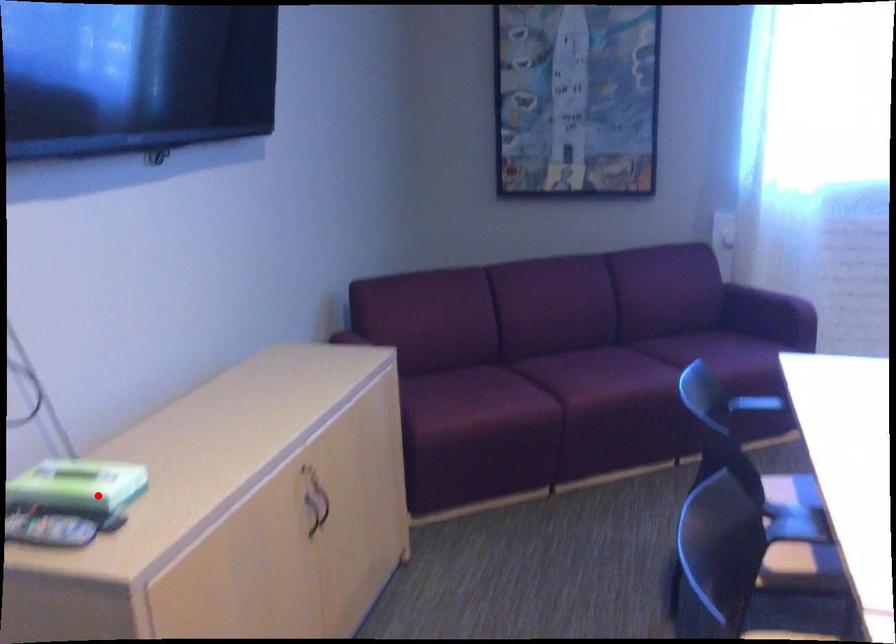
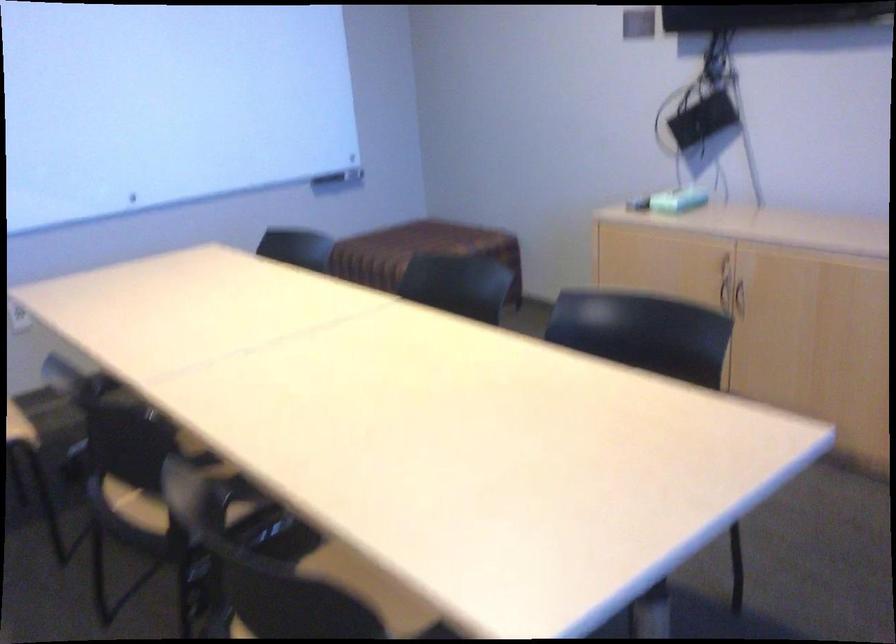
Question: I am providing you with two images of the same scene from different viewpoints. Given a red point in image1, look at the same physical point in image2. Is it:

Choices:
 (A) Closer to the viewpoint
 (B) Farther from the viewpoint

Answer: (B)